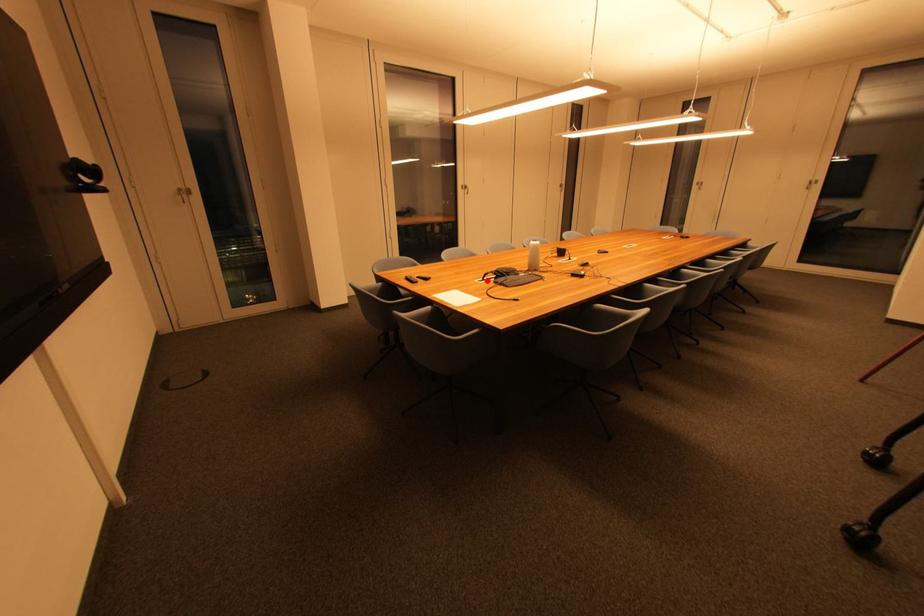
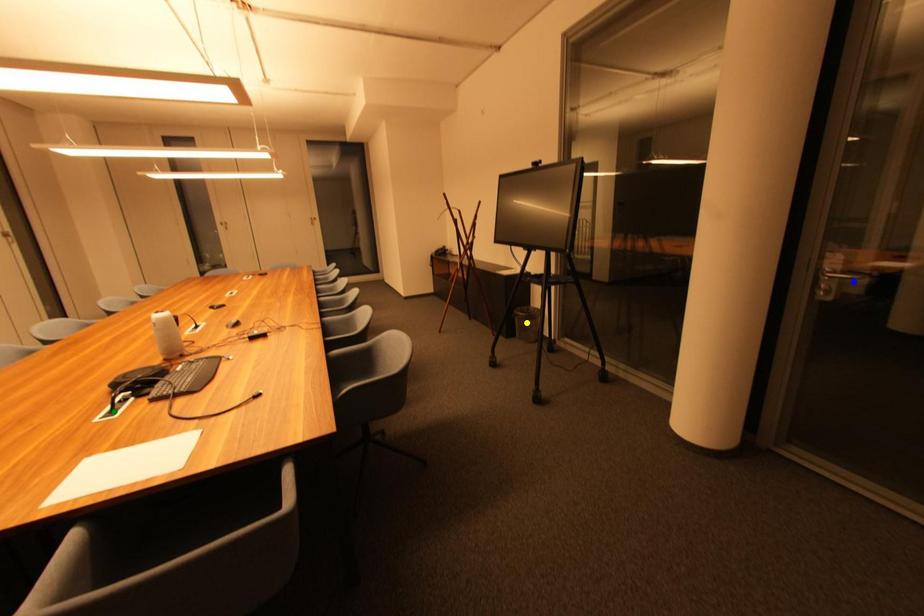
Question: I am providing you with two images of the same scene from different viewpoints. A red point is marked on the first image. You are given multiple points on the second image. In image 2, which mark is for the same physical point as the one in image 1?

Choices:
 (A) blue point
 (B) yellow point
 (C) green point

Answer: (C)